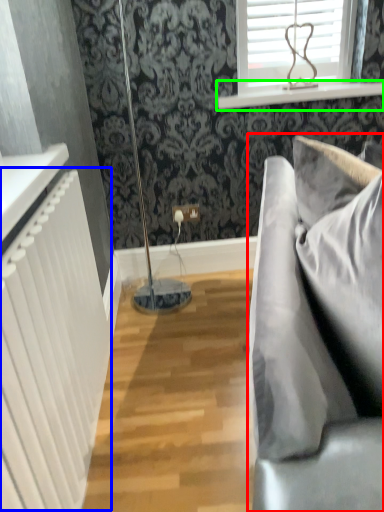
Question: Based on their relative distances, which object is nearer to studio couch (highlighted by a red box)? Choose from radiator (highlighted by a blue box) and window sill (highlighted by a green box).

Choices:
 (A) radiator
 (B) window sill

Answer: (A)